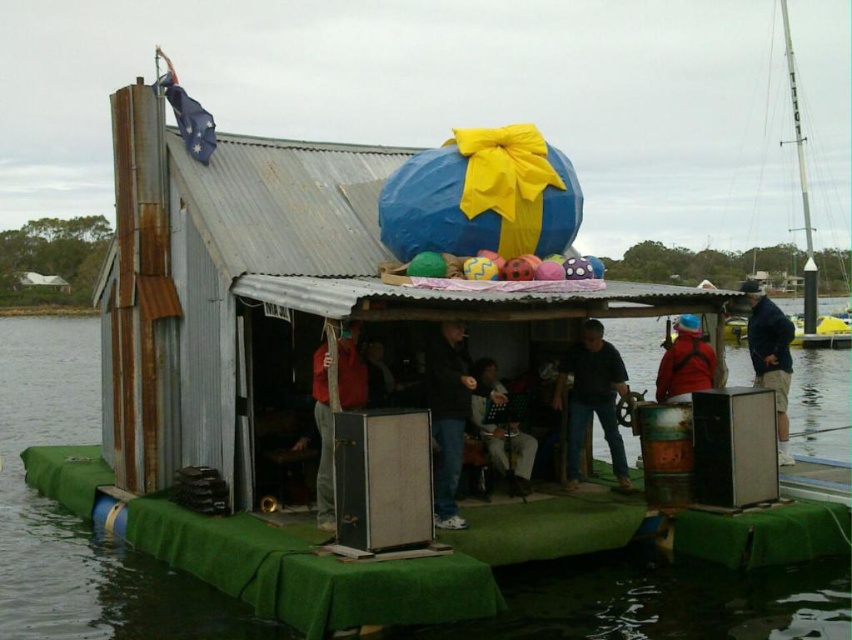
Based on the photo, you are a fashion designer observing the image. You see a dark blue shirt at center and a red fabric jacket at center. Which clothing item is covering the other?

The dark blue shirt at center is positioned over the red fabric jacket at center, so it is covering the jacket.

You are standing on the deck of the houseboat and need to reach both the dark blue shirt at center and the red fabric jacket at center. If you can only carry one item at a time, which item should you pick up first to minimize the total distance walked?

You should pick up the dark blue shirt at center first since it is closer to your starting position on the deck. The dark blue shirt at center is 3.28 meters from the red fabric jacket at center, so picking up the farther item second reduces backtracking.

You are standing on the deck of the houseboat and want to place a small potted plant between the green fabric at center and the dark blue jacket at center. Based on their widths, which object should the plant be closer to?

The green fabric at center might be wider than dark blue jacket at center, so the plant should be placed closer to the dark blue jacket at center to ensure it fits within the available space.